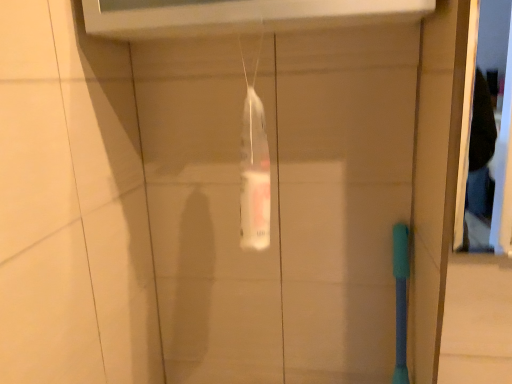
The height and width of the screenshot is (384, 512). Describe the element at coordinates (254, 166) in the screenshot. I see `transparent plastic shower at center` at that location.

Measure the distance between transparent plastic shower at center and camera.

31.14 inches.

I want to click on transparent plastic shower at center, so click(x=254, y=166).

Identify the location of transparent plastic shower at center. The width and height of the screenshot is (512, 384). (254, 166).